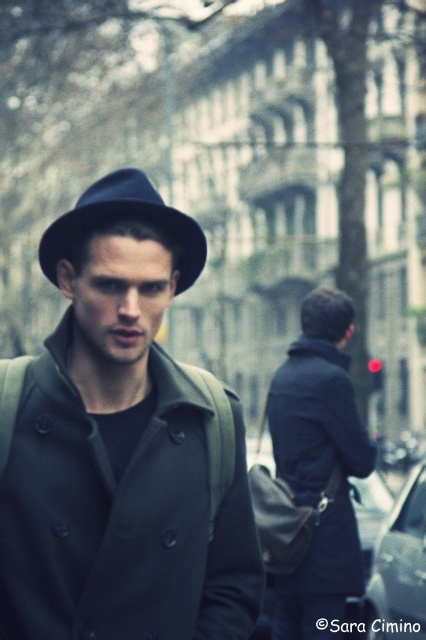
Question: Does matte black coat at center appear on the left side of matte black fedora at center?

Choices:
 (A) no
 (B) yes

Answer: (A)

Question: Which object is closer to the camera taking this photo?

Choices:
 (A) matte black coat at center
 (B) dark blue leather jacket at center
 (C) matte black fedora at center

Answer: (A)

Question: Does matte black coat at center appear on the left side of matte black fedora at center?

Choices:
 (A) no
 (B) yes

Answer: (A)

Question: Based on their relative distances, which object is nearer to the dark blue leather jacket at center?

Choices:
 (A) matte black fedora at center
 (B) matte black coat at center

Answer: (A)

Question: In this image, where is matte black coat at center located relative to matte black fedora at center?

Choices:
 (A) below
 (B) above

Answer: (B)

Question: Which point is farther from the camera taking this photo?

Choices:
 (A) (288, 445)
 (B) (132, 212)

Answer: (A)